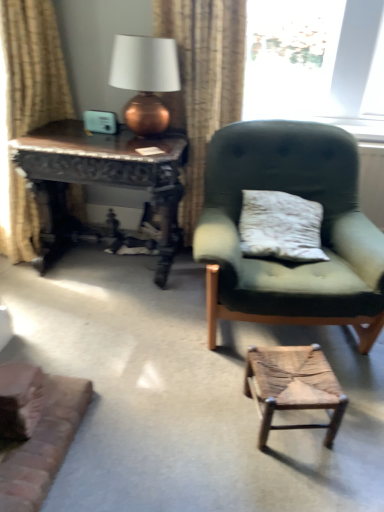
Question: Is beige textured curtain at upper center, which is the 2th curtain from left to right, taller or shorter than green fabric chair at center?

Choices:
 (A) short
 (B) tall

Answer: (B)

Question: From a real-world perspective, is beige textured curtain at upper center, which is the 2th curtain from left to right, physically located above or below green fabric chair at center?

Choices:
 (A) above
 (B) below

Answer: (A)

Question: Which object is the farthest from the rustic wood stool at lower center?

Choices:
 (A) wooden carved table at left
 (B) copper metallic table lamp at upper left
 (C) beige textured curtain at upper center, acting as the first curtain starting from the right
 (D) green fabric chair at center
 (E) beige fabric curtain at left, the first curtain when ordered from left to right

Answer: (E)

Question: Which object is positioned closest to the beige textured curtain at upper center, which is the 2th curtain from left to right?

Choices:
 (A) copper metallic table lamp at upper left
 (B) beige fabric curtain at left, the first curtain when ordered from left to right
 (C) green fabric chair at center
 (D) wooden carved table at left
 (E) rustic wood stool at lower center

Answer: (A)